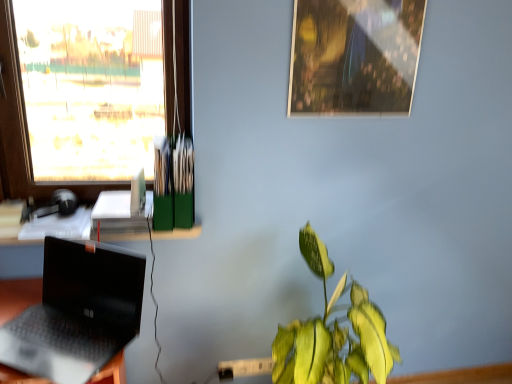
At what (x,y) coordinates should I click in order to perform the action: click on white plastic power outlet at lower center. Please return your answer as a coordinate pair (x, y). Looking at the image, I should click on (244, 368).

Describe the element at coordinates (333, 333) in the screenshot. Image resolution: width=512 pixels, height=384 pixels. I see `green glossy leafy plant at lower right` at that location.

Image resolution: width=512 pixels, height=384 pixels. Describe the element at coordinates (354, 57) in the screenshot. I see `metallic reflective photo frame at upper center` at that location.

This screenshot has height=384, width=512. Describe the element at coordinates (24, 129) in the screenshot. I see `transparent glass window at upper left` at that location.

At what (x,y) coordinates should I click in order to perform the action: click on black matte laptop at lower left. Please return your answer as a coordinate pair (x, y). This screenshot has width=512, height=384. Looking at the image, I should click on (18, 296).

Locate an element on the screen. This screenshot has width=512, height=384. white plastic power outlet at lower center is located at coordinates (244, 368).

Considering the sizes of objects black matte laptop at lower left and transparent glass window at upper left in the image provided, who is bigger, black matte laptop at lower left or transparent glass window at upper left?

black matte laptop at lower left.

Where is `window above the black matte laptop at lower left (from the image's perspective)`? The image size is (512, 384). window above the black matte laptop at lower left (from the image's perspective) is located at coordinates (24, 129).

Does black matte laptop at lower left have a greater width compared to transparent glass window at upper left?

Yes.

Which point is more distant from viewer, [33,289] or [2,4]?

The point [33,289] is more distant.

From a real-world perspective, does black matte laptop at lower left stand above green glossy leafy plant at lower right?

No, from a real-world perspective, black matte laptop at lower left is not above green glossy leafy plant at lower right.

Is black matte laptop at lower left turned away from green glossy leafy plant at lower right?

No.

Between black matte laptop at lower left and green glossy leafy plant at lower right, which one appears on the left side from the viewer's perspective?

black matte laptop at lower left is more to the left.

How many degrees apart are the facing directions of black matte laptop at lower left and green glossy leafy plant at lower right?

2.61 degrees.

Would you say metallic reflective photo frame at upper center is inside or outside black matte laptop at lower left?

metallic reflective photo frame at upper center cannot be found inside black matte laptop at lower left.

Who is taller, metallic reflective photo frame at upper center or black matte laptop at lower left?

black matte laptop at lower left.

Would you say metallic reflective photo frame at upper center is a long distance from black matte laptop at lower left?

Absolutely, metallic reflective photo frame at upper center is distant from black matte laptop at lower left.

Is metallic reflective photo frame at upper center bigger than black matte laptop at lower left?

No, metallic reflective photo frame at upper center is not bigger than black matte laptop at lower left.

Between point (20, 124) and point (4, 281), which one is positioned in front?

The point (4, 281) is more forward.

Which of these two, transparent glass window at upper left or black matte laptop at lower left, is wider?

With larger width is black matte laptop at lower left.

Would you consider transparent glass window at upper left to be distant from metallic reflective photo frame at upper center?

Yes, transparent glass window at upper left and metallic reflective photo frame at upper center are quite far apart.

From a real-world perspective, relative to metallic reflective photo frame at upper center, is transparent glass window at upper left vertically above or below?

transparent glass window at upper left is situated lower than metallic reflective photo frame at upper center in the real world.

Based on the photo, how far apart are transparent glass window at upper left and metallic reflective photo frame at upper center?

transparent glass window at upper left is 3.38 feet away from metallic reflective photo frame at upper center.

Can we say transparent glass window at upper left lies outside metallic reflective photo frame at upper center?

Yes, transparent glass window at upper left is not within metallic reflective photo frame at upper center.

Between white plastic power outlet at lower center and green glossy leafy plant at lower right, which one appears on the right side from the viewer's perspective?

Positioned to the right is green glossy leafy plant at lower right.

Does white plastic power outlet at lower center have a lesser width compared to green glossy leafy plant at lower right?

Indeed, white plastic power outlet at lower center has a lesser width compared to green glossy leafy plant at lower right.

The width and height of the screenshot is (512, 384). There is a white plastic power outlet at lower center. In order to click on houseplant above it (from a real-world perspective) in this screenshot , I will do `click(333, 333)`.

From the image's perspective, which one is positioned lower, white plastic power outlet at lower center or green glossy leafy plant at lower right?

white plastic power outlet at lower center.

Is green glossy leafy plant at lower right inside or outside of transparent glass window at upper left?

green glossy leafy plant at lower right is spatially situated outside transparent glass window at upper left.

Is green glossy leafy plant at lower right wider or thinner than transparent glass window at upper left?

Clearly, green glossy leafy plant at lower right has more width compared to transparent glass window at upper left.

At what (x,y) coordinates should I click in order to perform the action: click on houseplant in front of the transparent glass window at upper left. Please return your answer as a coordinate pair (x, y). Looking at the image, I should click on (333, 333).

From a real-world perspective, is green glossy leafy plant at lower right over transparent glass window at upper left?

No, from a real-world perspective, green glossy leafy plant at lower right is not over transparent glass window at upper left

Locate an element on the screen. desk on the left of transparent glass window at upper left is located at coordinates (18, 296).

Find the location of a particular element. The height and width of the screenshot is (384, 512). desk below the green glossy leafy plant at lower right (from a real-world perspective) is located at coordinates (18, 296).

Looking at the image, which one is located further to white plastic power outlet at lower center, green glossy leafy plant at lower right or black matte laptop at lower left?

black matte laptop at lower left is further to white plastic power outlet at lower center.

From the image, which object appears to be farther from green glossy leafy plant at lower right, metallic reflective photo frame at upper center or black matte laptop at lower left?

Among the two, black matte laptop at lower left is located further to green glossy leafy plant at lower right.

When comparing their distances from green glossy leafy plant at lower right, does white plastic power outlet at lower center or transparent glass window at upper left seem further?

The object further to green glossy leafy plant at lower right is transparent glass window at upper left.

Based on their spatial positions, is transparent glass window at upper left or metallic reflective photo frame at upper center closer to green glossy leafy plant at lower right?

metallic reflective photo frame at upper center is positioned closer to the anchor green glossy leafy plant at lower right.

When comparing their distances from metallic reflective photo frame at upper center, does white plastic power outlet at lower center or transparent glass window at upper left seem further?

white plastic power outlet at lower center is further to metallic reflective photo frame at upper center.

Estimate the real-world distances between objects in this image. Which object is further from transparent glass window at upper left, black matte laptop at lower left or metallic reflective photo frame at upper center?

metallic reflective photo frame at upper center lies further to transparent glass window at upper left than the other object.

Looking at the image, which one is located further to green glossy leafy plant at lower right, black matte laptop at lower left or white plastic power outlet at lower center?

Among the two, black matte laptop at lower left is located further to green glossy leafy plant at lower right.

Looking at the image, which one is located closer to metallic reflective photo frame at upper center, green glossy leafy plant at lower right or white plastic power outlet at lower center?

green glossy leafy plant at lower right.

Locate an element on the screen. houseplant between metallic reflective photo frame at upper center and black matte laptop at lower left vertically is located at coordinates (333, 333).

I want to click on window between metallic reflective photo frame at upper center and green glossy leafy plant at lower right in the up-down direction, so click(x=24, y=129).

Locate an element on the screen. This screenshot has height=384, width=512. desk between transparent glass window at upper left and white plastic power outlet at lower center in the vertical direction is located at coordinates click(18, 296).

Identify the location of window between metallic reflective photo frame at upper center and white plastic power outlet at lower center in the vertical direction. The image size is (512, 384). (24, 129).